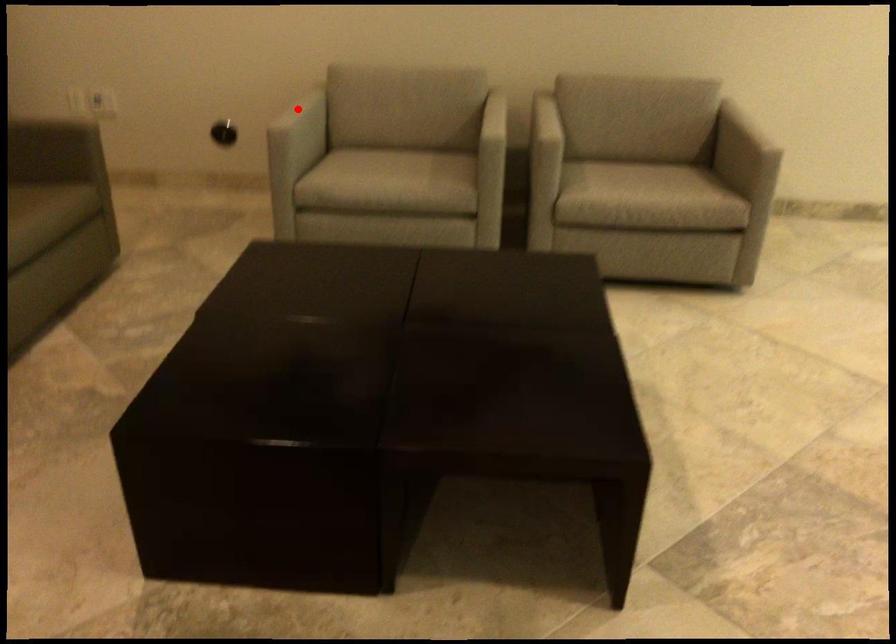
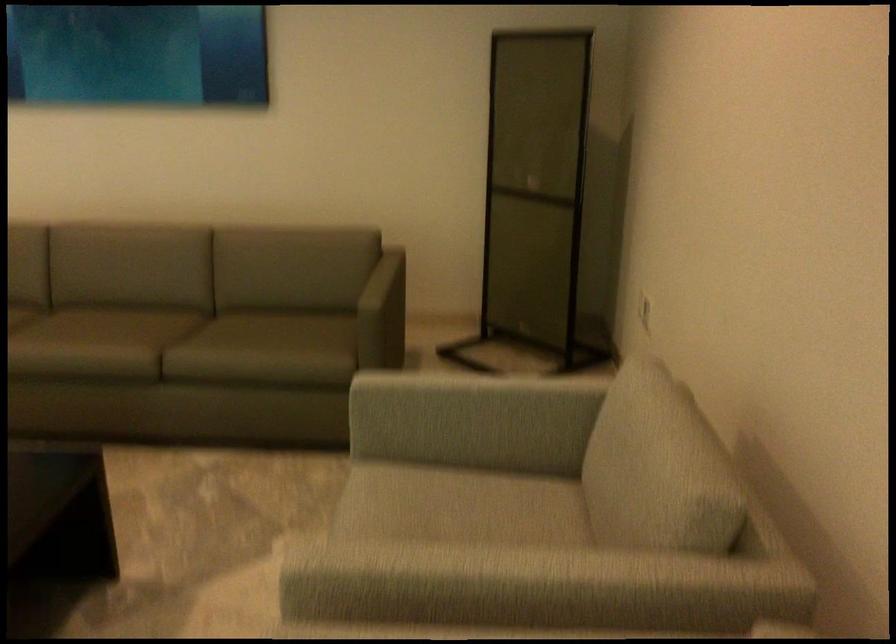
Question: A red point is marked in image1. In image2, is the corresponding 3D point closer to the camera or farther? Reply with the corresponding letter.

Choices:
 (A) The corresponding 3D point is closer.
 (B) The corresponding 3D point is farther.

Answer: (A)